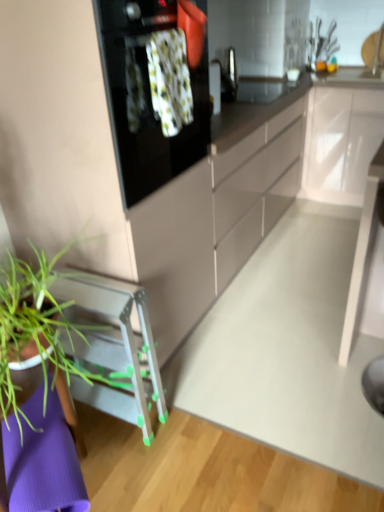
You are a GUI agent. You are given a task and a screenshot of the screen. Output one action in this format:
    pyautogui.click(x=<x>, y=<y>)
    Task: Click on the blank space to the left of white glossy table at center
    The width and height of the screenshot is (384, 512).
    Given the screenshot: What is the action you would take?
    pyautogui.click(x=291, y=386)